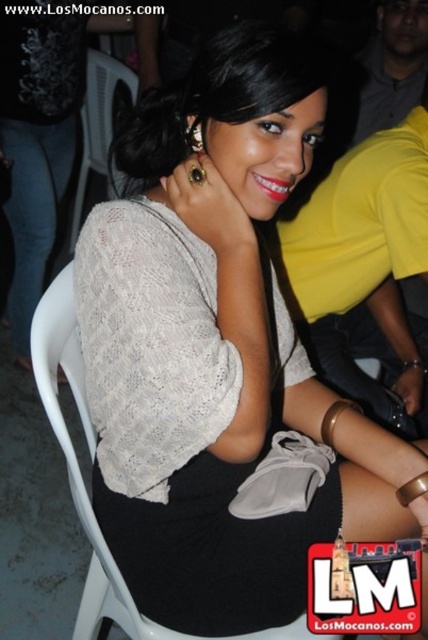
You are at an indoor social event and need to choose a seat. You see a white plastic chair at center and a white plastic chair at upper left. Which chair is shorter?

The white plastic chair at center is shorter than the white plastic chair at upper left.